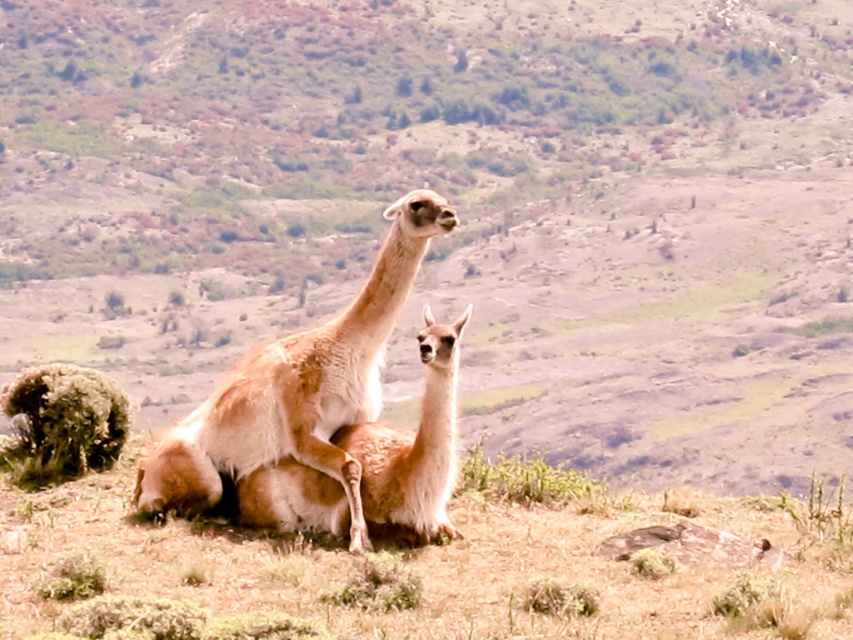
Question: From the image, what is the correct spatial relationship of dry grass at center in relation to fuzzy brown alpaca at center?

Choices:
 (A) right
 (B) left

Answer: (A)

Question: Which of the following is the closest to the observer?

Choices:
 (A) fuzzy brown alpaca at center
 (B) light brown woolen alpaca at center
 (C) dry grass at center

Answer: (C)

Question: Does dry grass at center appear on the left side of light brown woolen alpaca at center?

Choices:
 (A) yes
 (B) no

Answer: (B)

Question: From the image, what is the correct spatial relationship of dry grass at center in relation to fuzzy brown alpaca at center?

Choices:
 (A) below
 (B) above

Answer: (A)

Question: Based on their relative distances, which object is farther from the dry grass at center?

Choices:
 (A) fuzzy brown alpaca at center
 (B) light brown woolen alpaca at center

Answer: (B)

Question: Which of the following is the farthest from the observer?

Choices:
 (A) fuzzy brown alpaca at center
 (B) light brown woolen alpaca at center

Answer: (B)